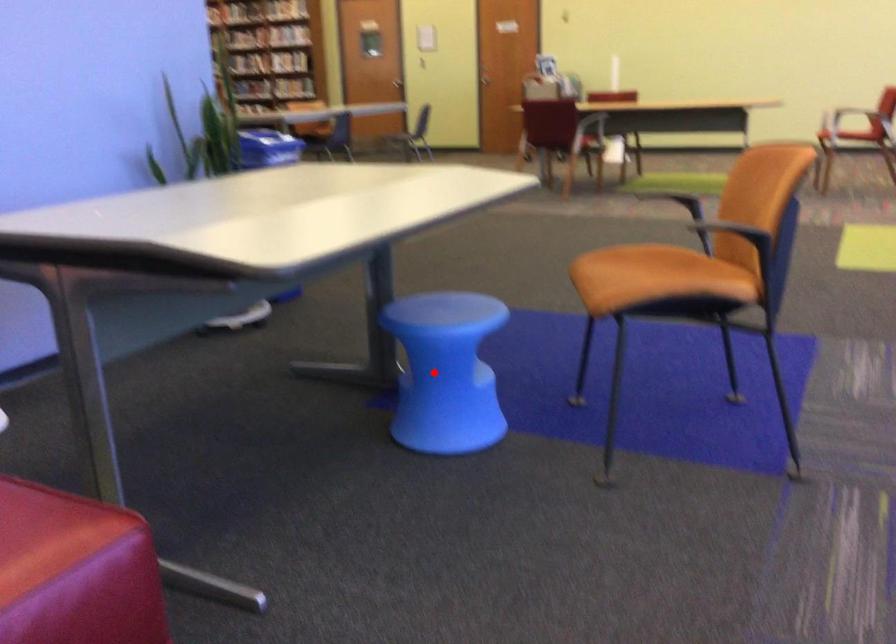
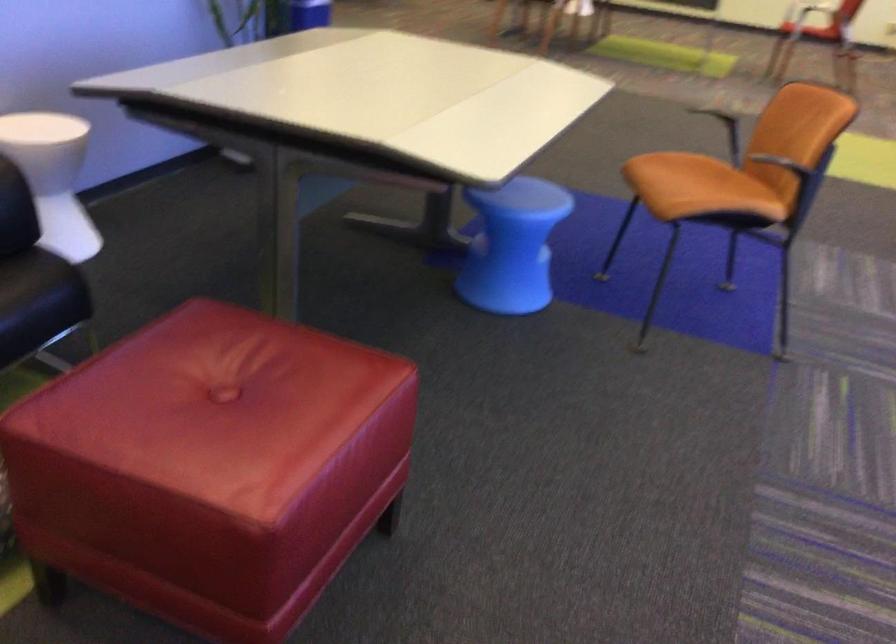
The point at the highlighted location is marked in the first image. Where is the corresponding point in the second image?

(512, 245)